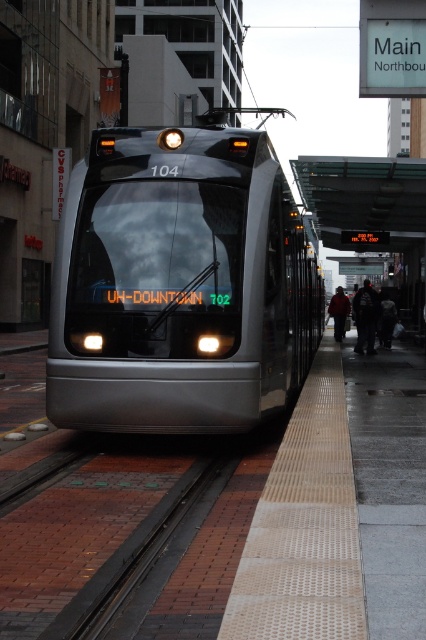
Between polished metal train at center and perforated beige platform at center, which one appears on the left side from the viewer's perspective?

Positioned to the left is polished metal train at center.

Does polished metal train at center have a greater height compared to perforated beige platform at center?

In fact, polished metal train at center may be shorter than perforated beige platform at center.

Is point (161, 339) farther from viewer compared to point (340, 600)?

Yes, it is behind point (340, 600).

You are a GUI agent. You are given a task and a screenshot of the screen. Output one action in this format:
    pyautogui.click(x=<x>, y=<y>)
    Task: Click on the polished metal train at center
    
    Given the screenshot: What is the action you would take?
    pyautogui.click(x=178, y=284)

From the picture: Is perforated beige platform at center thinner than dark gray jacket at center?

No.

How far apart are perforated beige platform at center and dark gray jacket at center?

perforated beige platform at center and dark gray jacket at center are 12.09 meters apart.

The width and height of the screenshot is (426, 640). I want to click on perforated beige platform at center, so click(340, 509).

Identify the location of perforated beige platform at center. This screenshot has width=426, height=640. (340, 509).

Which is more to the left, black fabric commuter at center or dark gray jacket at center?

Positioned to the left is dark gray jacket at center.

Does black fabric commuter at center have a lesser height compared to dark gray jacket at center?

Incorrect, black fabric commuter at center's height does not fall short of dark gray jacket at center's.

Is point (367, 289) positioned before point (342, 292)?

Yes, point (367, 289) is closer to viewer.

Where is `black fabric commuter at center`? The image size is (426, 640). black fabric commuter at center is located at coordinates pyautogui.click(x=365, y=317).